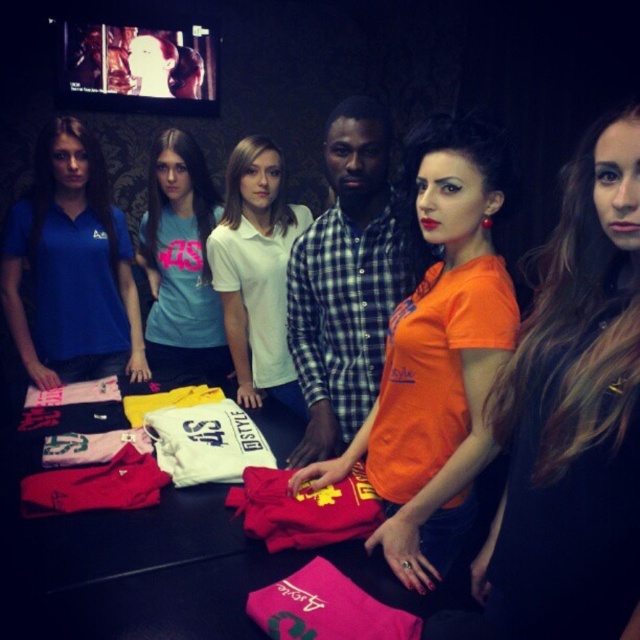
Question: Where is blue cotton polo shirt at left located in relation to white cotton polo shirt at center in the image?

Choices:
 (A) below
 (B) above

Answer: (B)

Question: Which point appears farthest from the camera in this image?

Choices:
 (A) (458, 314)
 (B) (268, 282)

Answer: (B)

Question: Which point is closer to the camera?

Choices:
 (A) matte red t-shirt at center
 (B) light blue t-shirt at center
 (C) orange matte t-shirt at center

Answer: (C)

Question: Does orange matte t-shirt at center appear on the right side of matte red t-shirt at center?

Choices:
 (A) yes
 (B) no

Answer: (A)

Question: Which point is farther to the camera?

Choices:
 (A) (209, 344)
 (B) (84, 205)
 (C) (312, 515)
 (D) (602, 214)

Answer: (A)

Question: Does orange matte t-shirt at center appear over pink fabric t-shirt at lower center?

Choices:
 (A) yes
 (B) no

Answer: (A)